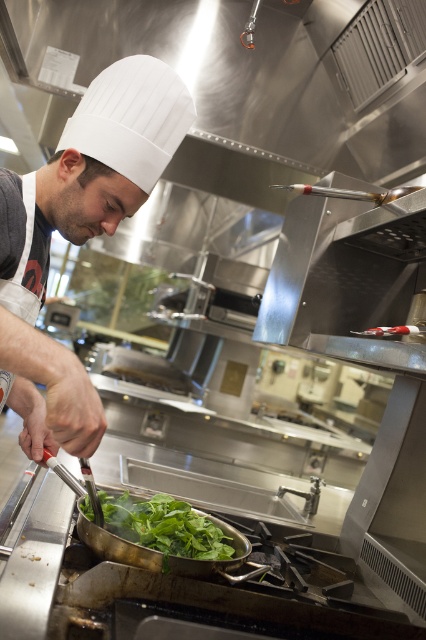
You are a chef standing in front of the stove and need to reach two points in the kitchen. The first point is at coordinate point(74,209) and the second is at point(155,509). Which point is closer to you?

Point(74,209) is closer to the viewer than point(155,509).

In the scene shown: You are a kitchen assistant who needs to determine the relative size of the white matte chef hat at upper left and the green leafy vegetable at center. Which object is taller?

The white matte chef hat at upper left has a greater height compared to the green leafy vegetable at center, so the white matte chef hat at upper left is taller.